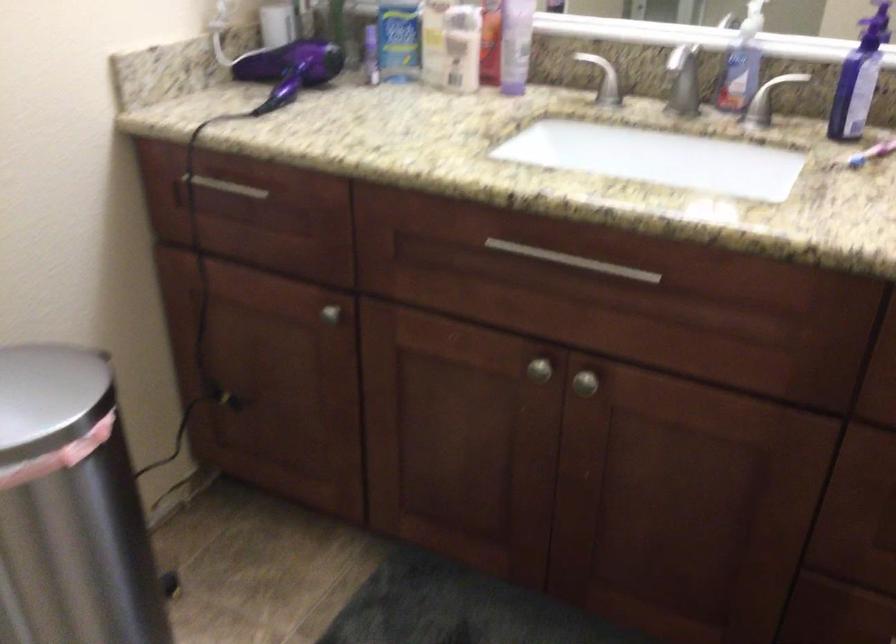
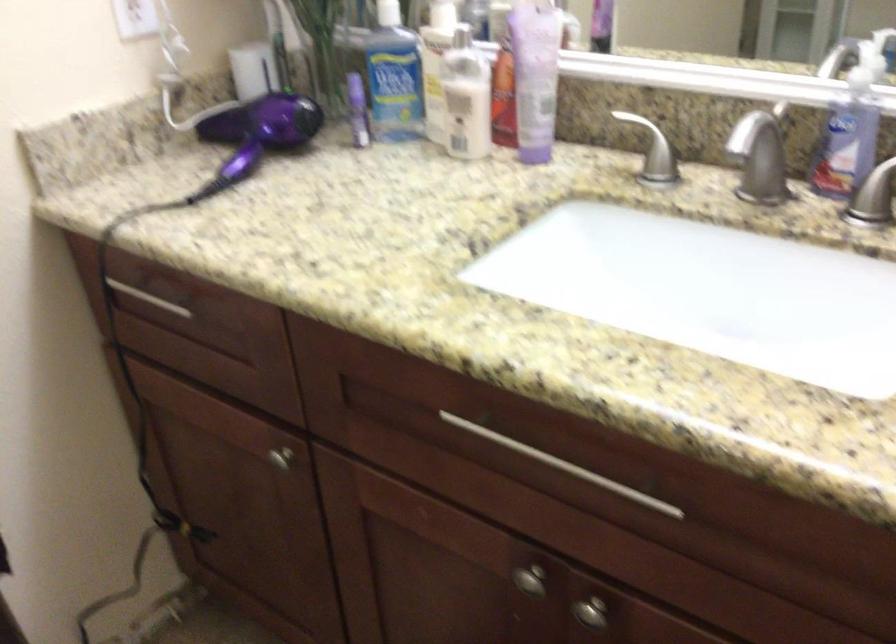
The point at (x=297, y=71) is marked in the first image. Where is the corresponding point in the second image?

(256, 134)